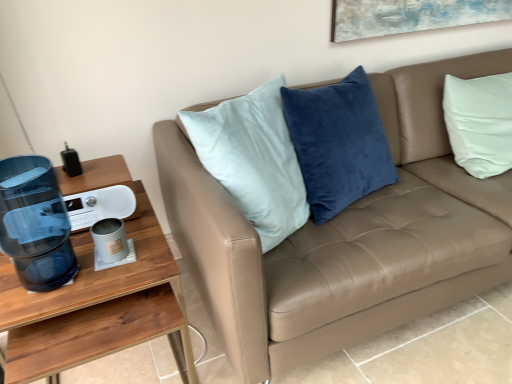
Find the location of a particular element. Image resolution: width=512 pixels, height=384 pixels. free space to the right of transparent plastic water cooler at left is located at coordinates (114, 272).